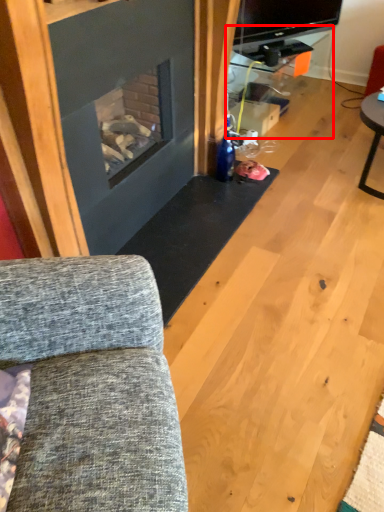
Question: Considering the relative positions of entertainment center (annotated by the red box) and studio couch in the image provided, where is entertainment center (annotated by the red box) located with respect to the staircase?

Choices:
 (A) right
 (B) left

Answer: (A)